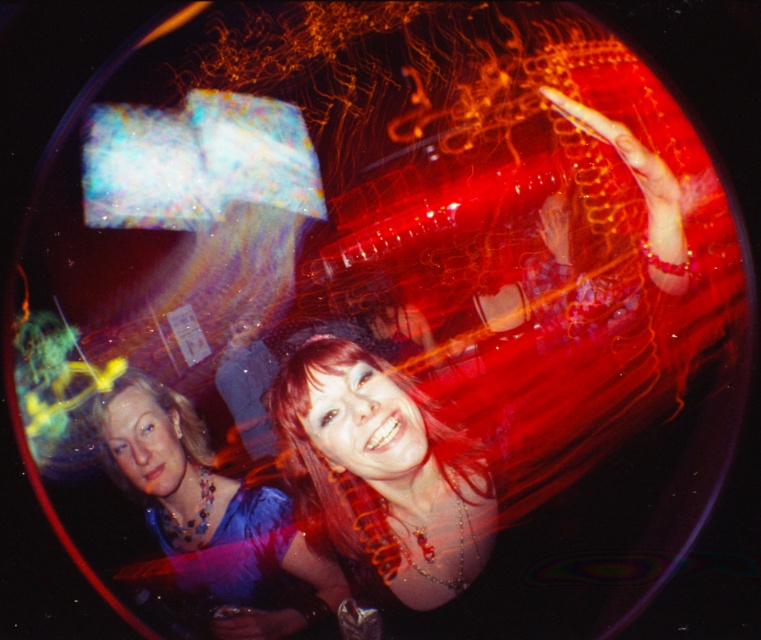
You are at the center of the image and want to move towards the shiny red hair at center. In which direction should you move?

You should move towards the point at coordinates [381,472] to reach the shiny red hair at center.

You are a photographer at a party and notice two items in the scene described. The first is the shiny red hair at center, and the second is the shiny blue dress at lower left. Which of these items has a narrower width?

The shiny red hair at center is thinner than the shiny blue dress at lower left, so the shiny red hair at center has a narrower width.

Based on the photo, you are at a party and see the shiny red hair at center and the shiny blue dress at lower left. Which object is located above the other?

The shiny red hair at center is positioned over the shiny blue dress at lower left.